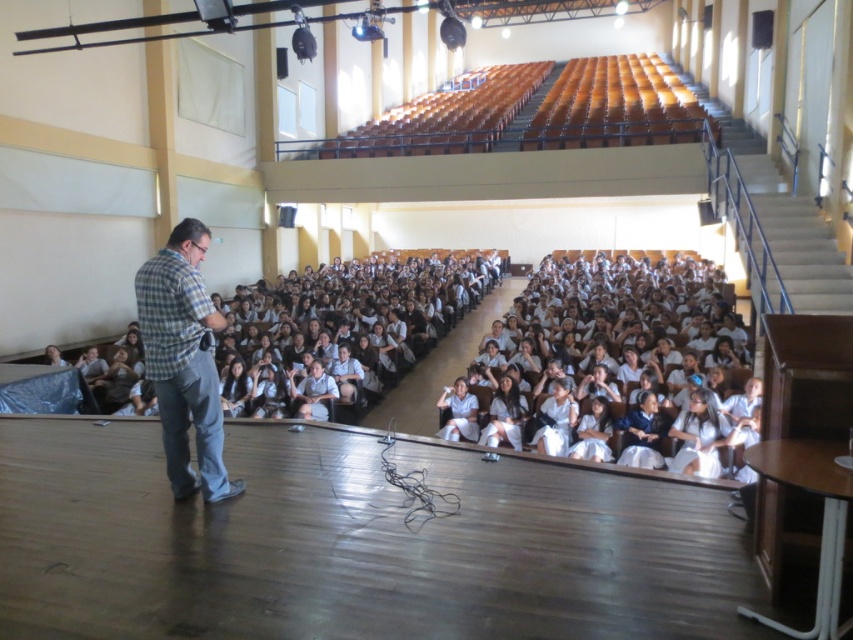
Is point (608, 289) in front of point (155, 339)?

No, it is not.

Based on the photo, does white uniformed students at center appear over plaid shirt at left?

Indeed, white uniformed students at center is positioned over plaid shirt at left.

Who is more distant from viewer, (526,300) or (195,282)?

Point (526,300)

Where is `white uniformed students at center`? Image resolution: width=853 pixels, height=640 pixels. white uniformed students at center is located at coordinates (593, 413).